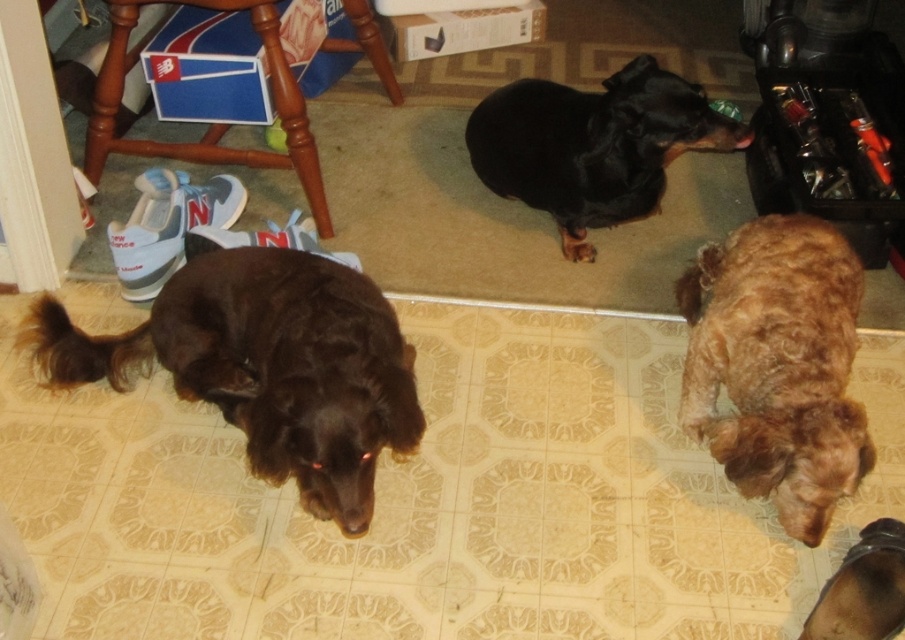
Question: Is shiny brown fur at lower right further to camera compared to brown furry dog at lower right?

Choices:
 (A) no
 (B) yes

Answer: (B)

Question: Can you confirm if brown wood stool at upper left is smaller than brown furry dog at lower right?

Choices:
 (A) yes
 (B) no

Answer: (B)

Question: Which of the following is the farthest from the observer?

Choices:
 (A) brown furry dog at lower right
 (B) shiny brown fur at lower right
 (C) black smooth coat dog at center
 (D) brown furry dog at center

Answer: (C)

Question: Can you confirm if brown furry dog at center is bigger than brown furry dog at lower right?

Choices:
 (A) yes
 (B) no

Answer: (A)

Question: Which point is farther to the camera?

Choices:
 (A) (121, 150)
 (B) (698, 282)

Answer: (A)

Question: Among these objects, which one is nearest to the camera?

Choices:
 (A) shiny brown fur at lower right
 (B) brown furry dog at lower right

Answer: (B)